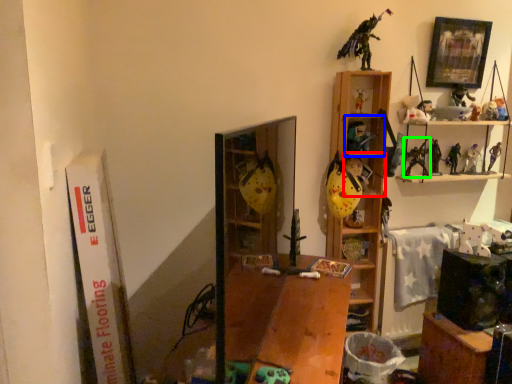
Question: Which is farther away from cabinet (highlighted by a red box)? cabinet (highlighted by a blue box) or toy (highlighted by a green box)?

Choices:
 (A) cabinet
 (B) toy

Answer: (B)